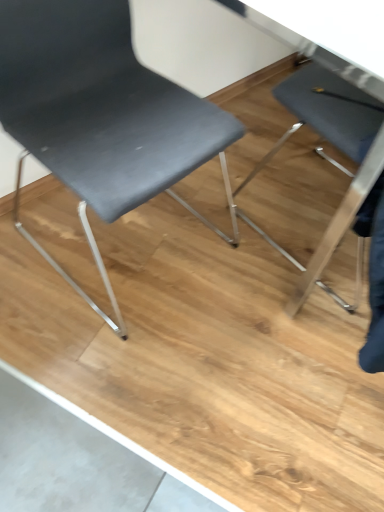
Question: From the image's perspective, is matte black chair at right, marked as the 1th chair in a right-to-left arrangement, positioned above or below matte black chair at left, the second chair when ordered from right to left?

Choices:
 (A) above
 (B) below

Answer: (B)

Question: Considering their positions, is matte black chair at right, which appears as the second chair when viewed from the left, located in front of or behind matte black chair at left, marked as the first chair in a left-to-right arrangement?

Choices:
 (A) front
 (B) behind

Answer: (B)

Question: Looking at their shapes, would you say matte black chair at right, marked as the 1th chair in a right-to-left arrangement, is wider or thinner than matte black chair at left, the second chair when ordered from right to left?

Choices:
 (A) wide
 (B) thin

Answer: (B)

Question: Is matte black chair at left, the second chair when ordered from right to left, bigger or smaller than matte black chair at right, marked as the 1th chair in a right-to-left arrangement?

Choices:
 (A) small
 (B) big

Answer: (B)

Question: Is point (69, 168) positioned closer to the camera than point (329, 118)?

Choices:
 (A) farther
 (B) closer

Answer: (B)

Question: Visually, is matte black chair at left, marked as the first chair in a left-to-right arrangement, positioned to the left or to the right of matte black chair at right, marked as the 1th chair in a right-to-left arrangement?

Choices:
 (A) left
 (B) right

Answer: (A)

Question: From the image's perspective, is matte black chair at left, marked as the first chair in a left-to-right arrangement, located above or below matte black chair at right, which appears as the second chair when viewed from the left?

Choices:
 (A) below
 (B) above

Answer: (B)